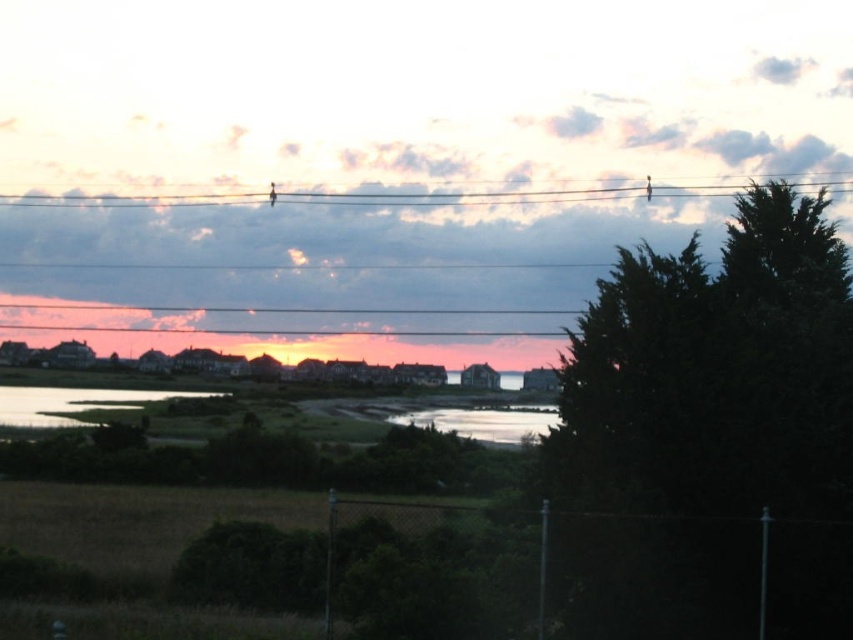
Question: Which of the following is the farthest from the observer?

Choices:
 (A) (688, 394)
 (B) (689, 189)
 (C) (486, 420)

Answer: (B)

Question: Can you confirm if black wire at upper center is positioned to the left of silvery reflective water at center?

Choices:
 (A) no
 (B) yes

Answer: (B)

Question: Which object appears farthest from the camera in this image?

Choices:
 (A) green grassy water at lower left
 (B) black wire at upper center
 (C) dark green textured tree at right

Answer: (B)

Question: Does dark green textured tree at right appear over silvery reflective water at center?

Choices:
 (A) no
 (B) yes

Answer: (B)

Question: Which of the following is the farthest from the observer?

Choices:
 (A) silvery reflective water at center
 (B) green grassy water at lower left
 (C) dark green textured tree at right

Answer: (B)

Question: Can you confirm if black wire at upper center is bigger than silvery reflective water at center?

Choices:
 (A) no
 (B) yes

Answer: (A)